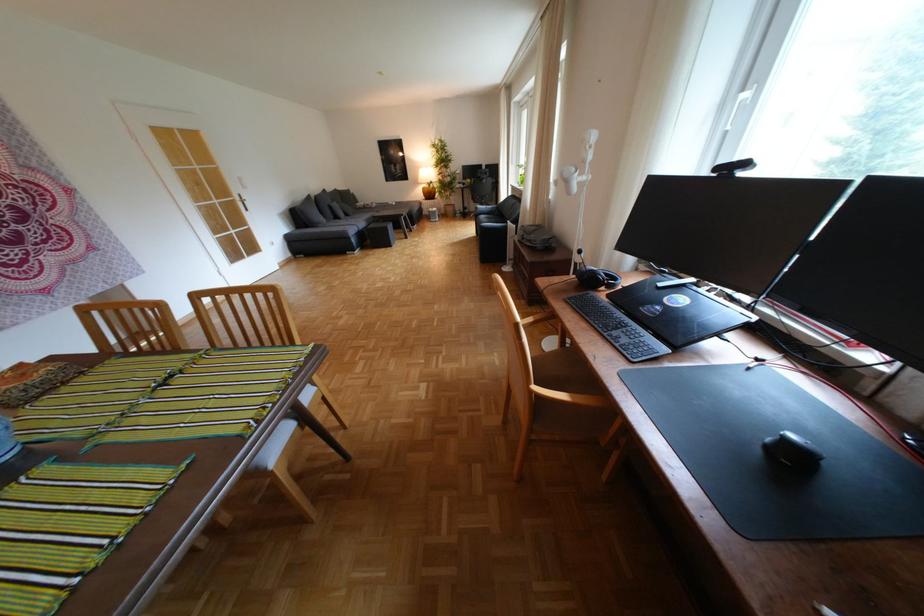
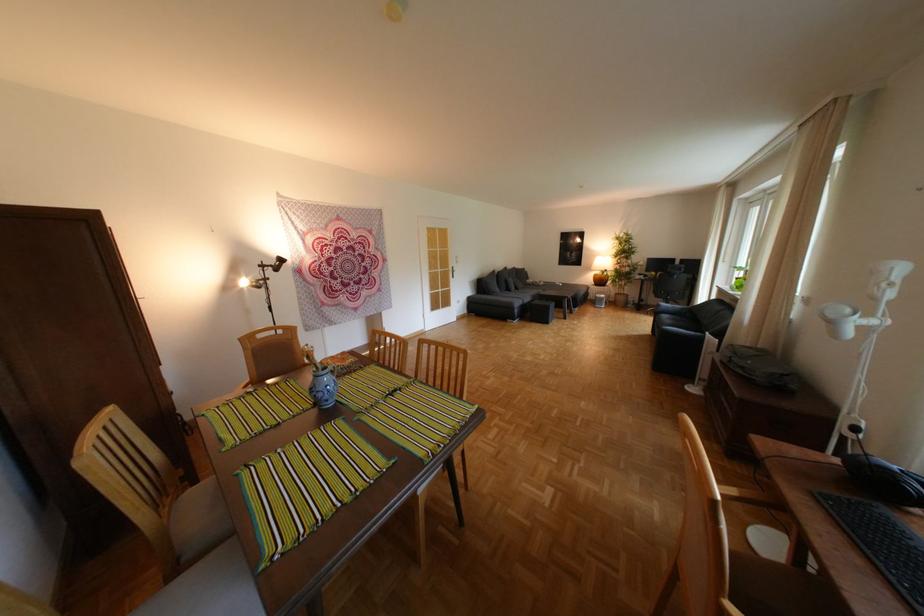
Where in the second image is the point corresponding to (597,325) from the first image?

(870, 560)